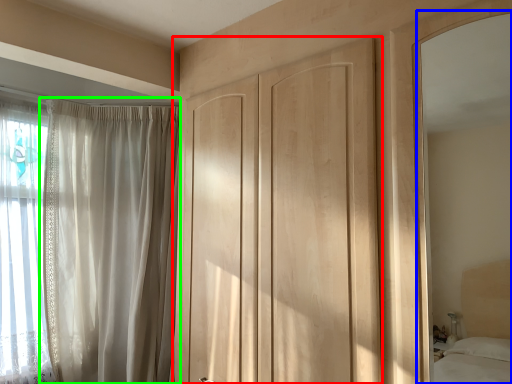
Question: Estimate the real-world distances between objects in this image. Which object is farther from door (highlighted by a red box), mirror (highlighted by a blue box) or curtain (highlighted by a green box)?

Choices:
 (A) mirror
 (B) curtain

Answer: (A)